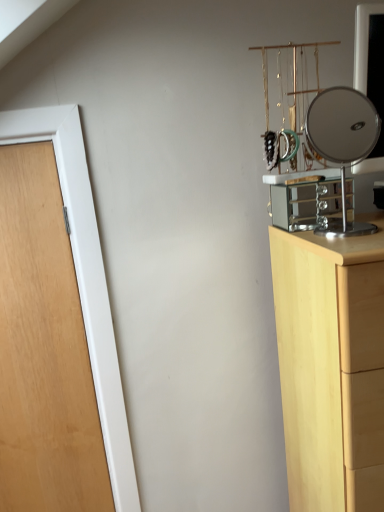
Question: Is wooden door at left wider than light wood chest of drawers at right?

Choices:
 (A) no
 (B) yes

Answer: (A)

Question: From a real-world perspective, is wooden door at left below light wood chest of drawers at right?

Choices:
 (A) yes
 (B) no

Answer: (B)

Question: Is wooden door at left to the left of light wood chest of drawers at right from the viewer's perspective?

Choices:
 (A) no
 (B) yes

Answer: (B)

Question: From a real-world perspective, is wooden door at left positioned over light wood chest of drawers at right based on gravity?

Choices:
 (A) no
 (B) yes

Answer: (B)

Question: Is wooden door at left thinner than light wood chest of drawers at right?

Choices:
 (A) yes
 (B) no

Answer: (A)

Question: Is wooden door at left positioned beyond the bounds of light wood chest of drawers at right?

Choices:
 (A) yes
 (B) no

Answer: (A)

Question: Is polished silver mirror at right at the right side of wooden door at left?

Choices:
 (A) no
 (B) yes

Answer: (B)

Question: Is the position of polished silver mirror at right more distant than that of wooden door at left?

Choices:
 (A) yes
 (B) no

Answer: (B)

Question: Are polished silver mirror at right and wooden door at left located far from each other?

Choices:
 (A) yes
 (B) no

Answer: (A)

Question: Is polished silver mirror at right positioned with its back to wooden door at left?

Choices:
 (A) no
 (B) yes

Answer: (A)

Question: From the image's perspective, is polished silver mirror at right below wooden door at left?

Choices:
 (A) yes
 (B) no

Answer: (B)

Question: Is wooden door at left located within polished silver mirror at right?

Choices:
 (A) no
 (B) yes

Answer: (A)

Question: Is light wood chest of drawers at right in front of wooden door at left?

Choices:
 (A) no
 (B) yes

Answer: (B)